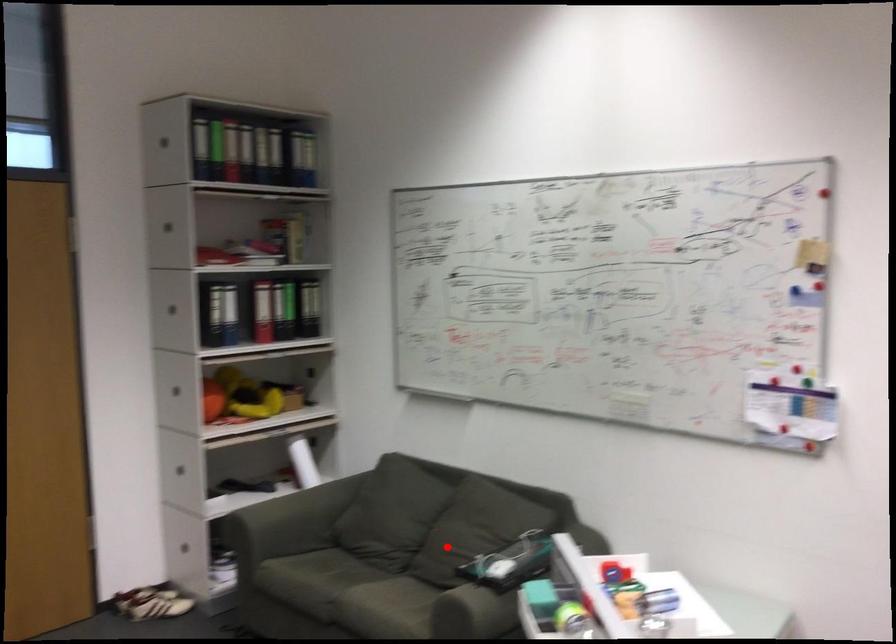
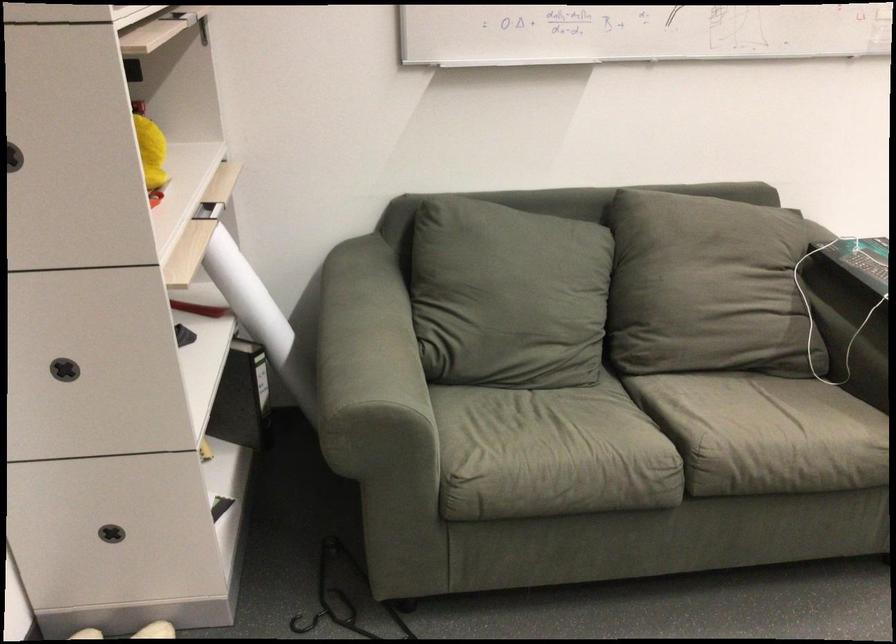
Question: I am providing you with two images of the same scene from different viewpoints. A red point is shown in image1. For the corresponding object point in image2, is it positioned nearer or farther from the camera?

Choices:
 (A) Nearer
 (B) Farther

Answer: (A)